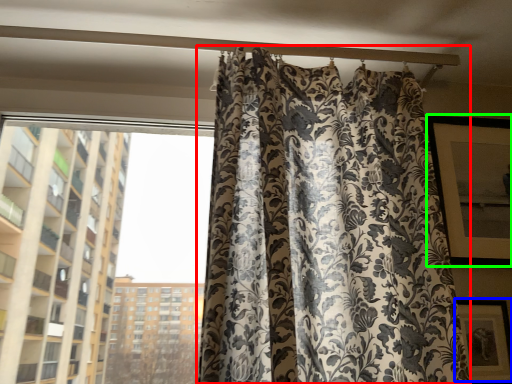
Question: Estimate the real-world distances between objects in this image. Which object is closer to curtain (highlighted by a red box), picture frame (highlighted by a blue box) or window screen (highlighted by a green box)?

Choices:
 (A) picture frame
 (B) window screen

Answer: (B)